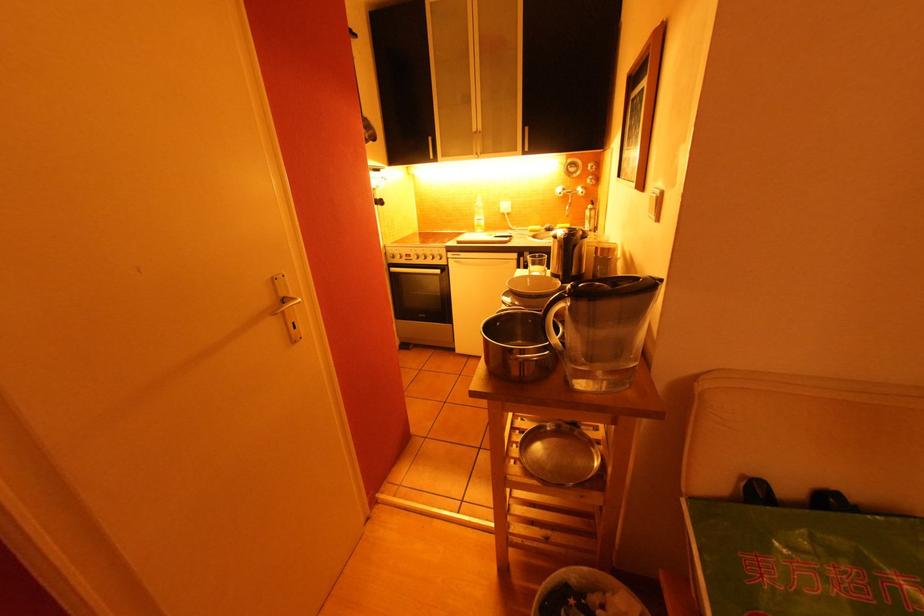
Locate an element on the screen. This screenshot has width=924, height=616. water pitcher handle is located at coordinates (554, 325).